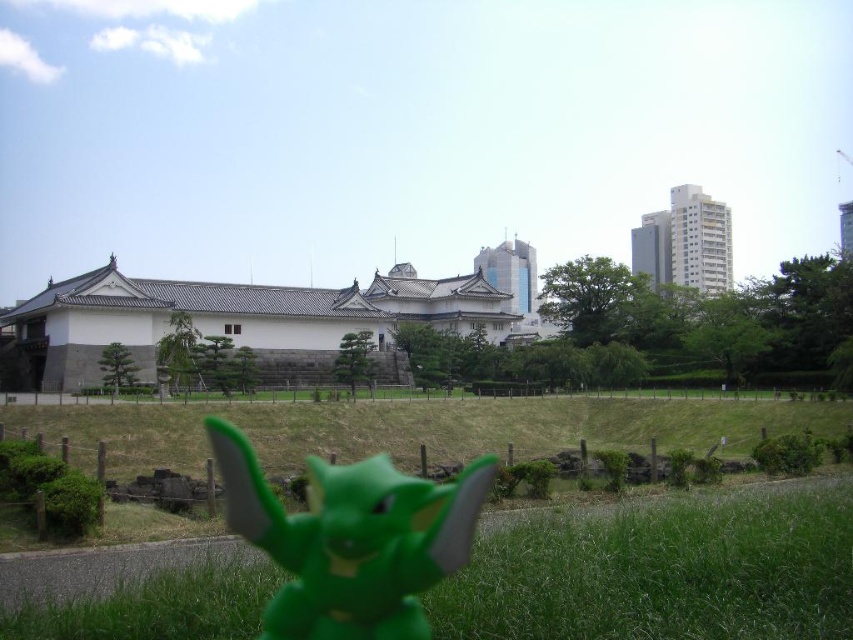
You are a gardener planning to plant a new flower bed in the scene. You have two areas to choose from, the green matte grass at lower center and the green grass at lower left. Which area is situated higher in elevation?

The green matte grass at lower center is positioned over the green grass at lower left, so it is higher in elevation.

You are standing at the green grass at lower left and want to place a 1.5 meter long fence between you and the green matte toy at center. Will the fence fit in the space between them?

The distance between the green grass at lower left and the green matte toy at center is 13.27 meters. Since the fence is only 1.5 meters long, there is enough space to place it between them.